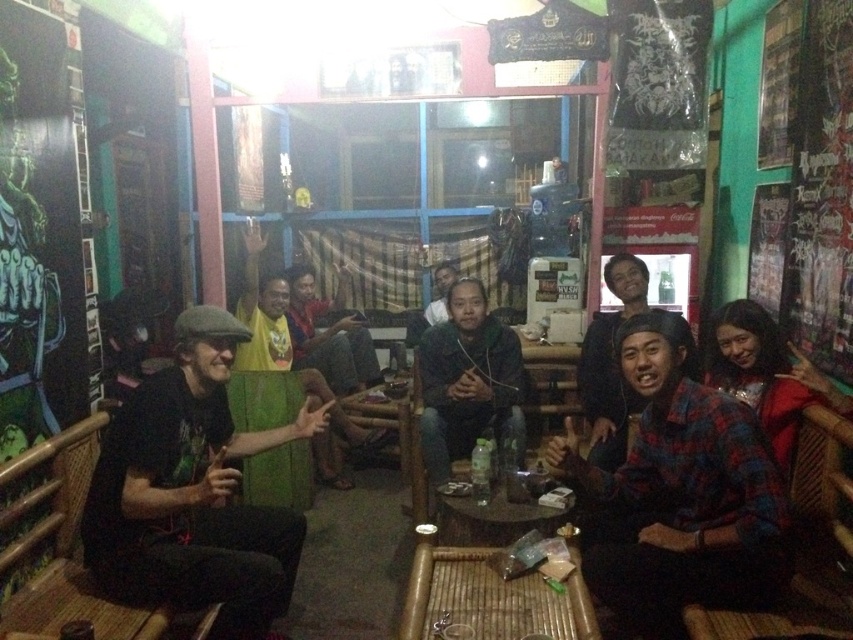
Question: Can you confirm if yellow fabric at center is smaller than clear plastic bottle at center?

Choices:
 (A) yes
 (B) no

Answer: (B)

Question: Among these objects, which one is nearest to the camera?

Choices:
 (A) bamboo tray at center
 (B) wooden textured table at center
 (C) red plaid shirt at lower right
 (D) dark green fabric at center

Answer: (A)

Question: Can you confirm if yellow fabric at center is wider than clear plastic bottle at center?

Choices:
 (A) no
 (B) yes

Answer: (B)

Question: Which point is closer to the camera?

Choices:
 (A) black matte shirt at left
 (B) plaid flannel shirt at right
 (C) dark green fabric at center
 (D) matte black shirt at center

Answer: (A)

Question: In this image, where is black matte shirt at left located relative to dark green fabric at center?

Choices:
 (A) left
 (B) right

Answer: (A)

Question: Which object is positioned farthest from the plaid flannel shirt at right?

Choices:
 (A) bamboo tray at center
 (B) clear plastic bottle at center
 (C) yellow fabric at center

Answer: (C)